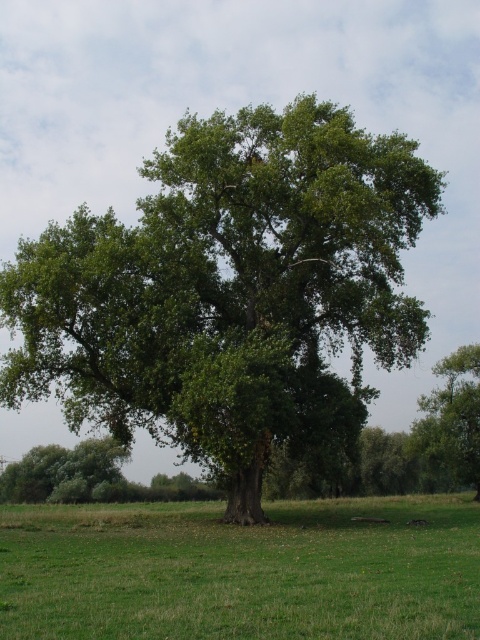
Question: Is green leafy oak tree at center positioned behind green grass at center?

Choices:
 (A) no
 (B) yes

Answer: (B)

Question: Among these points, which one is farthest from the camera?

Choices:
 (A) (104, 349)
 (B) (443, 504)
 (C) (429, 396)

Answer: (C)

Question: Among these points, which one is nearest to the camera?

Choices:
 (A) (476, 573)
 (B) (478, 387)

Answer: (A)

Question: Based on their relative distances, which object is farther from the green leafy oak tree at center?

Choices:
 (A) green leafy tree at center
 (B) green grass at center

Answer: (A)

Question: Does green grass at center come behind green leafy tree at center?

Choices:
 (A) yes
 (B) no

Answer: (B)

Question: Does green leafy oak tree at center have a larger size compared to green leafy tree at center?

Choices:
 (A) no
 (B) yes

Answer: (B)